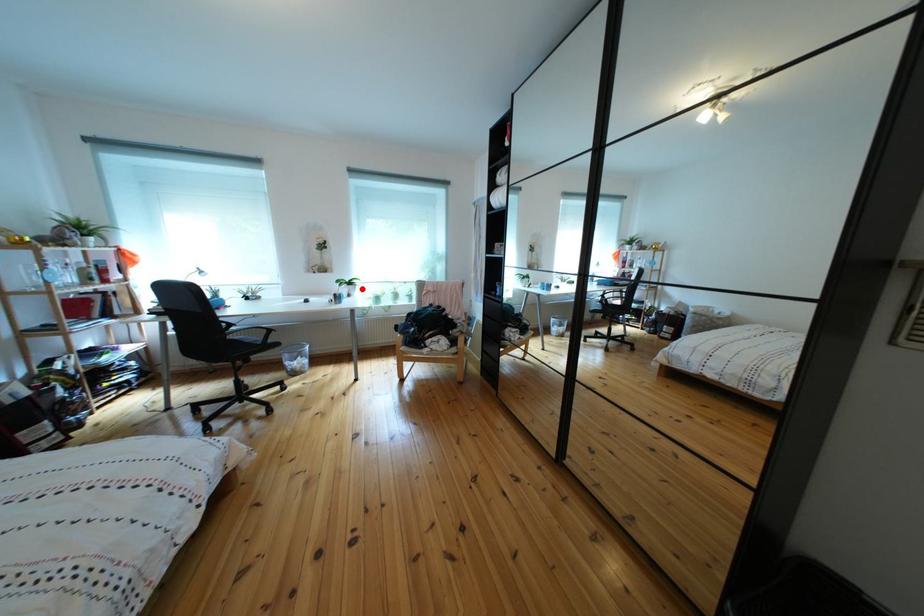
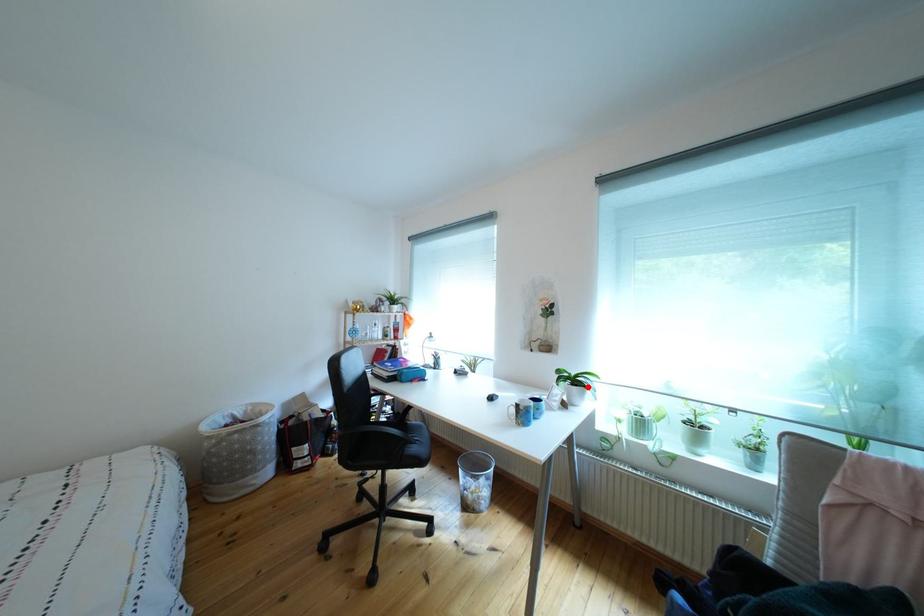
I am providing you with two images of the same scene from different viewpoints. A red point is marked on the first image and another point is marked on the second image. Is the red point in image1 aligned with the point shown in image2?

Yes